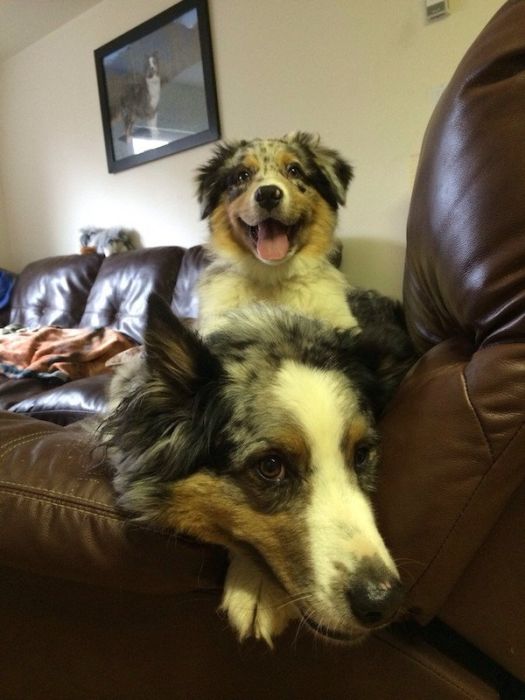
Locate an element on the screen. The image size is (525, 700). blanket is located at coordinates (57, 344).